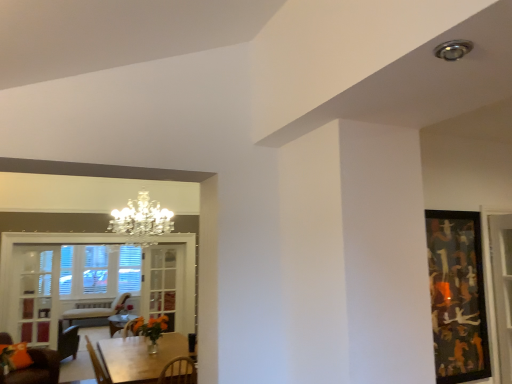
Where is `vacant region above abstract painting at right (from a real-world perspective)`? Image resolution: width=512 pixels, height=384 pixels. vacant region above abstract painting at right (from a real-world perspective) is located at coordinates (450, 213).